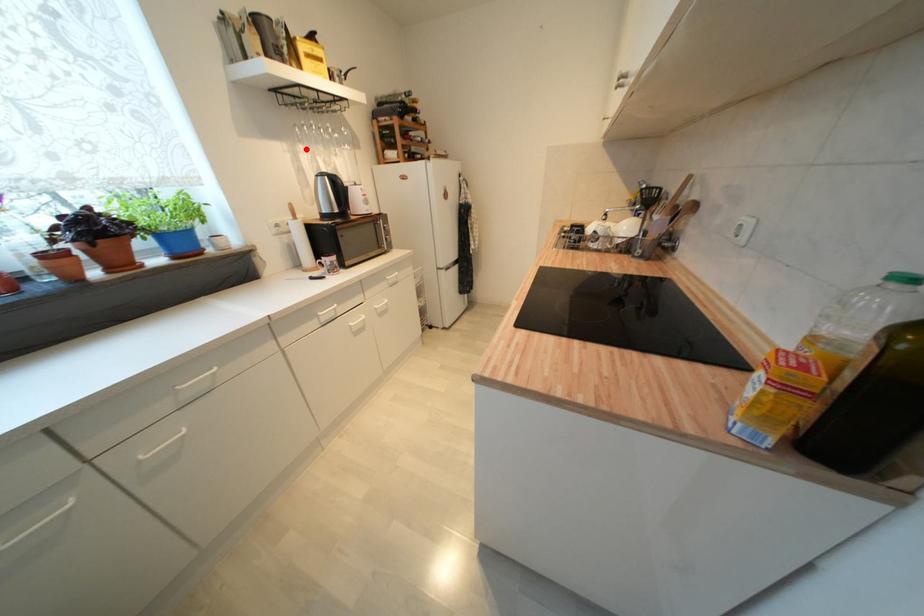
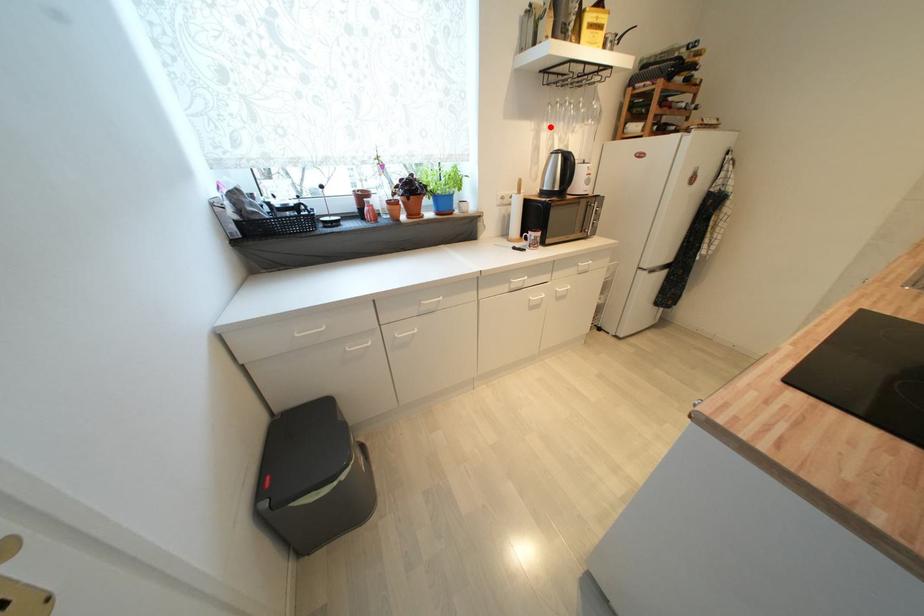
I am providing you with two images of the same scene from different viewpoints. A red point is marked on the first image and another point is marked on the second image. Is the red point in image1 aligned with the point shown in image2?

Yes